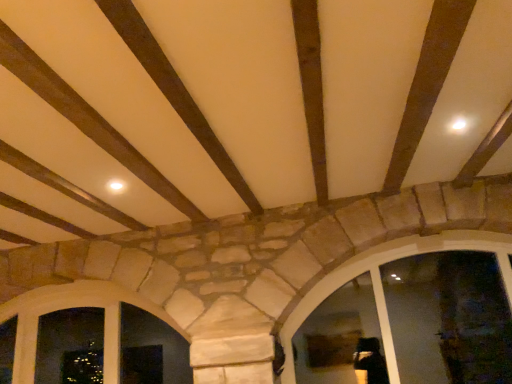
Question: Can you confirm if natural stone window at center, which is the second window from left to right, is thinner than natural stone window at lower left, the 2th window when ordered from right to left?

Choices:
 (A) yes
 (B) no

Answer: (B)

Question: Is natural stone window at center, placed as the first window when sorted from right to left, turned away from natural stone window at lower left, positioned as the 1th window in left-to-right order?

Choices:
 (A) no
 (B) yes

Answer: (A)

Question: Could you tell me if natural stone window at center, placed as the first window when sorted from right to left, is facing natural stone window at lower left, positioned as the 1th window in left-to-right order?

Choices:
 (A) yes
 (B) no

Answer: (B)

Question: Is natural stone window at center, placed as the first window when sorted from right to left, outside of natural stone window at lower left, positioned as the 1th window in left-to-right order?

Choices:
 (A) no
 (B) yes

Answer: (B)

Question: Is natural stone window at lower left, the 2th window when ordered from right to left, inside natural stone window at center, which is the second window from left to right?

Choices:
 (A) yes
 (B) no

Answer: (B)

Question: From a real-world perspective, does natural stone window at center, placed as the first window when sorted from right to left, stand above natural stone window at lower left, the 2th window when ordered from right to left?

Choices:
 (A) yes
 (B) no

Answer: (B)

Question: Is natural stone window at lower left, the 2th window when ordered from right to left, outside of natural stone window at center, which is the second window from left to right?

Choices:
 (A) no
 (B) yes

Answer: (B)

Question: From a real-world perspective, does natural stone window at lower left, positioned as the 1th window in left-to-right order, sit lower than natural stone window at center, placed as the first window when sorted from right to left?

Choices:
 (A) yes
 (B) no

Answer: (B)

Question: From the image's perspective, is natural stone window at lower left, the 2th window when ordered from right to left, over natural stone window at center, placed as the first window when sorted from right to left?

Choices:
 (A) no
 (B) yes

Answer: (A)

Question: Is natural stone window at center, placed as the first window when sorted from right to left, at the back of natural stone window at lower left, the 2th window when ordered from right to left?

Choices:
 (A) yes
 (B) no

Answer: (B)

Question: Can you confirm if natural stone window at lower left, positioned as the 1th window in left-to-right order, is smaller than natural stone window at center, which is the second window from left to right?

Choices:
 (A) yes
 (B) no

Answer: (A)

Question: Is natural stone window at lower left, the 2th window when ordered from right to left, to the left of natural stone window at center, placed as the first window when sorted from right to left, from the viewer's perspective?

Choices:
 (A) yes
 (B) no

Answer: (A)

Question: Is natural stone window at lower left, positioned as the 1th window in left-to-right order, inside the boundaries of natural stone window at center, placed as the first window when sorted from right to left, or outside?

Choices:
 (A) inside
 (B) outside

Answer: (B)